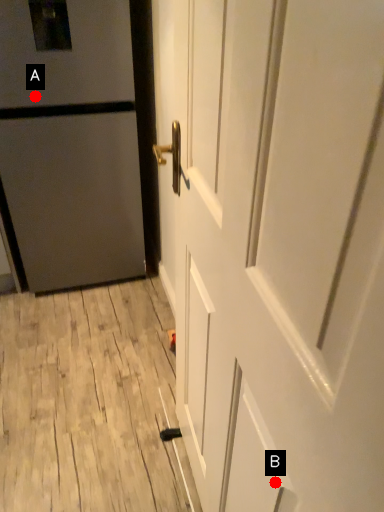
Question: Two points are circled on the image, labeled by A and B beside each circle. Among these points, which one is farthest from the camera?

Choices:
 (A) A is further
 (B) B is further

Answer: (A)